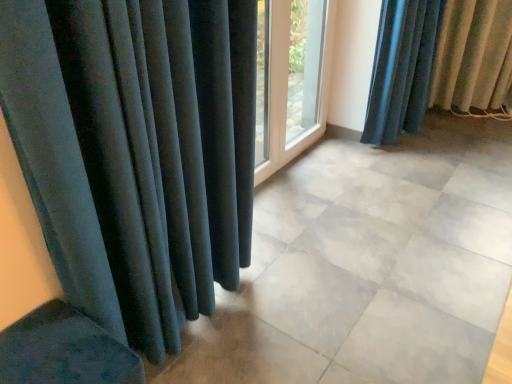
Question: Is velvet dark blue curtain at right inside white glass door at center?

Choices:
 (A) yes
 (B) no

Answer: (B)

Question: Can you confirm if white glass door at center is taller than velvet dark blue curtain at right?

Choices:
 (A) no
 (B) yes

Answer: (B)

Question: From a real-world perspective, is white glass door at center on top of velvet dark blue curtain at right?

Choices:
 (A) yes
 (B) no

Answer: (A)

Question: From a real-world perspective, is white glass door at center located beneath velvet dark blue curtain at right?

Choices:
 (A) no
 (B) yes

Answer: (A)

Question: Is white glass door at center positioned beyond the bounds of velvet dark blue curtain at right?

Choices:
 (A) yes
 (B) no

Answer: (A)

Question: Is white glass door at center facing towards velvet dark blue curtain at right?

Choices:
 (A) no
 (B) yes

Answer: (A)

Question: Can you see velvet dark blue curtain at right touching white glass door at center?

Choices:
 (A) no
 (B) yes

Answer: (A)

Question: Is velvet dark blue curtain at right wider than white glass door at center?

Choices:
 (A) yes
 (B) no

Answer: (A)

Question: From a real-world perspective, is velvet dark blue curtain at right on white glass door at center?

Choices:
 (A) yes
 (B) no

Answer: (B)

Question: Can you confirm if velvet dark blue curtain at right is shorter than white glass door at center?

Choices:
 (A) no
 (B) yes

Answer: (B)

Question: Does velvet dark blue curtain at right have a smaller size compared to white glass door at center?

Choices:
 (A) yes
 (B) no

Answer: (B)

Question: Considering the relative positions of velvet dark blue curtain at right and white glass door at center in the image provided, is velvet dark blue curtain at right to the left of white glass door at center from the viewer's perspective?

Choices:
 (A) yes
 (B) no

Answer: (B)

Question: In the image, is white glass door at center on the left side or the right side of velvet dark blue curtain at right?

Choices:
 (A) left
 (B) right

Answer: (A)